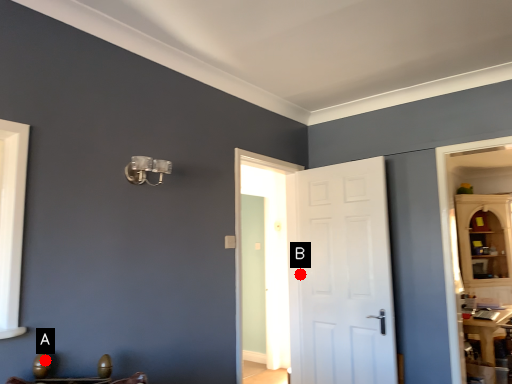
Question: Two points are circled on the image, labeled by A and B beside each circle. Which point appears farthest from the camera in this image?

Choices:
 (A) A is further
 (B) B is further

Answer: (B)